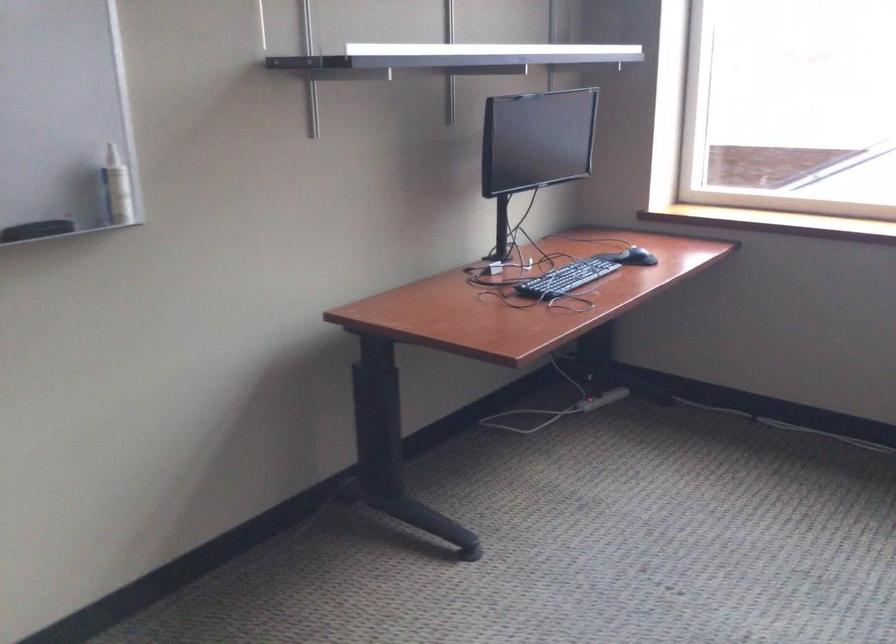
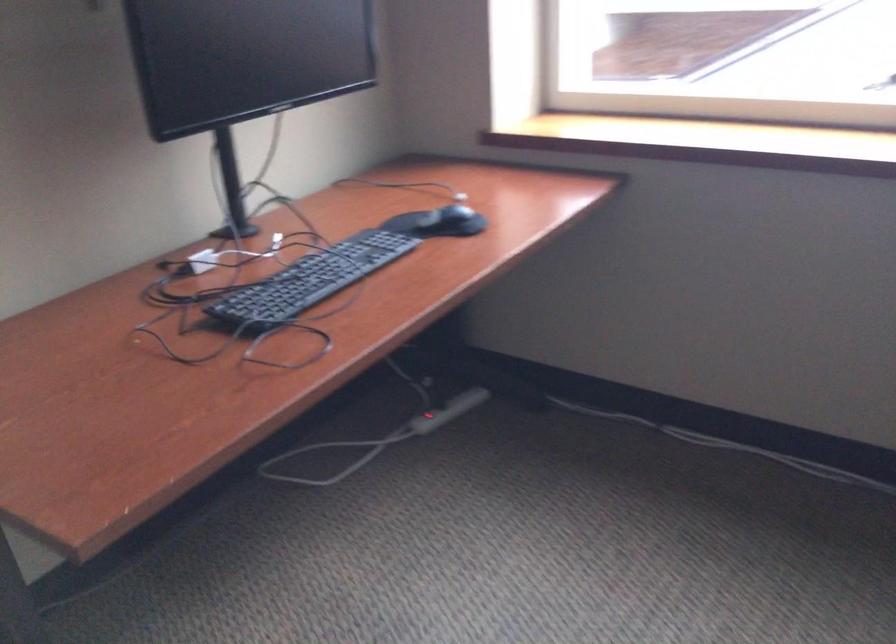
In the second image, find the point that corresponds to the point at 561,411 in the first image.

(378, 439)